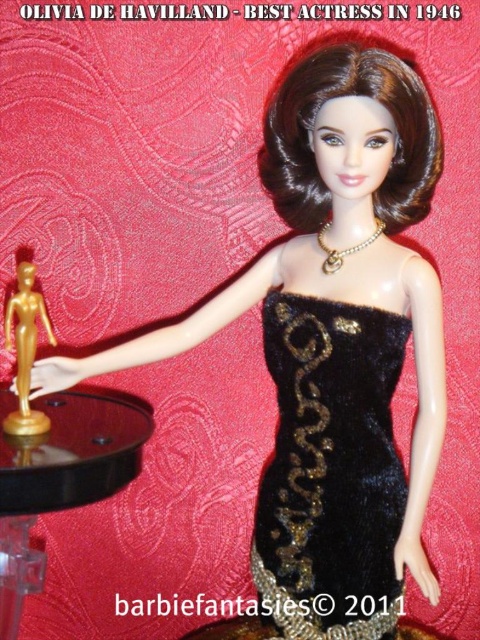
You are a photographer setting up a shoot. You need to place a small lamp on the black glossy table at lower left. Based on the coordinates provided, where should you position the lamp to ensure it is centered on the table?

The black glossy table at lower left is located at point (60, 476). To center the lamp, place it at the same coordinates as the table.

You are a photographer trying to capture the golden statuette on the black glossy table at lower left. However, the velvet black dress at center is blocking your view. Can you move the table to the side to get a clear shot?

The black glossy table at lower left is behind the velvet black dress at center, so moving the table might not be necessary as it is already positioned behind the dress. However, since the table is behind, adjusting your angle could allow you to capture the statuette without obstruction.

Looking at this image, you are a photographer adjusting the focus on your camera. You notice two points in the image at coordinates point (300, 321) and point (57, 460). Which point should you focus on to ensure the closest object is sharp?

You should focus on point (300, 321) because it is closer to the camera than point (57, 460), ensuring the closest object is in sharp focus.